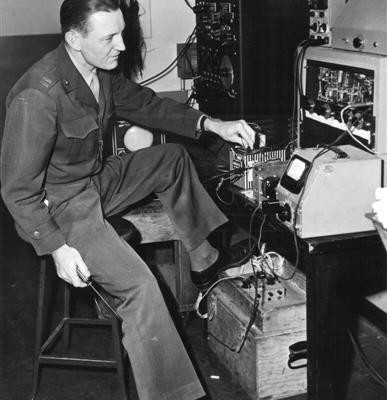
Image resolution: width=387 pixels, height=400 pixels. I want to click on black stool, so click(x=37, y=314).